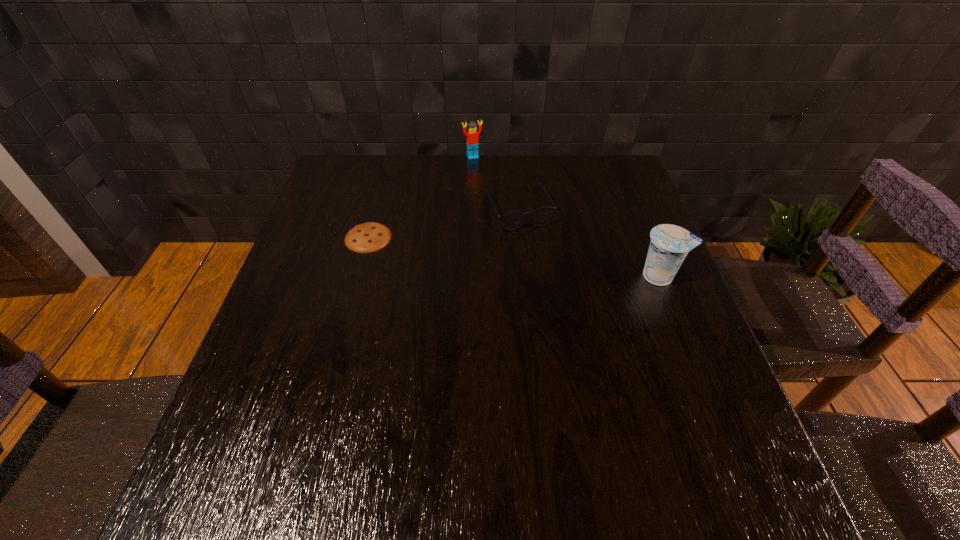
Locate an element on the screen. The height and width of the screenshot is (540, 960). free space that is in between the spectacles and the farthest object is located at coordinates (495, 183).

At what (x,y) coordinates should I click in order to perform the action: click on free space between the cookie and the spectacles. Please return your answer as a coordinate pair (x, y). Looking at the image, I should click on (444, 223).

I want to click on free spot between the spectacles and the second object from left to right, so click(495, 183).

Identify the location of vacant space that is in between the nearest object and the spectacles. The width and height of the screenshot is (960, 540). (589, 242).

Locate an element on the screen. This screenshot has height=540, width=960. vacant point located between the farthest object and the cookie is located at coordinates (420, 197).

Where is `vacant space that is in between the leftmost object and the second object from left to right`? Image resolution: width=960 pixels, height=540 pixels. vacant space that is in between the leftmost object and the second object from left to right is located at coordinates pos(420,197).

Locate which object is the second closest to the shortest object. Please provide its 2D coordinates. Your answer should be formatted as a tuple, i.e. [(x, y)], where the tuple contains the x and y coordinates of a point satisfying the conditions above.

[(472, 139)]

Identify which object is the second nearest to the third tallest object. Please provide its 2D coordinates. Your answer should be formatted as a tuple, i.e. [(x, y)], where the tuple contains the x and y coordinates of a point satisfying the conditions above.

[(670, 244)]

What are the coordinates of `free space that satisfies the following two spatial constraints: 1. on the back side of the shortest object; 2. on the right side of the second shortest object` in the screenshot? It's located at (376, 208).

You are a GUI agent. You are given a task and a screenshot of the screen. Output one action in this format:
    pyautogui.click(x=<x>, y=<y>)
    Task: Click on the free region that satisfies the following two spatial constraints: 1. on the front side of the yogurt; 2. on the right side of the Lego
    The image size is (960, 540).
    Given the screenshot: What is the action you would take?
    pyautogui.click(x=470, y=276)